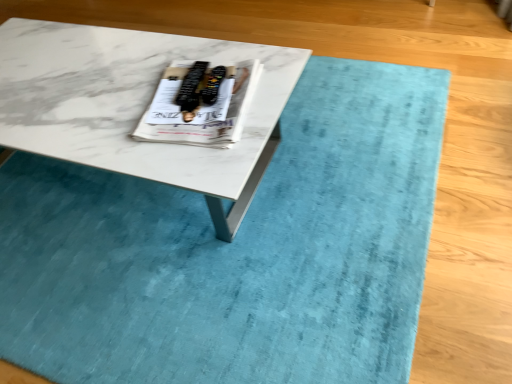
Identify the location of vacant area that is in front of white glossy magazine at center. Image resolution: width=512 pixels, height=384 pixels. (195, 158).